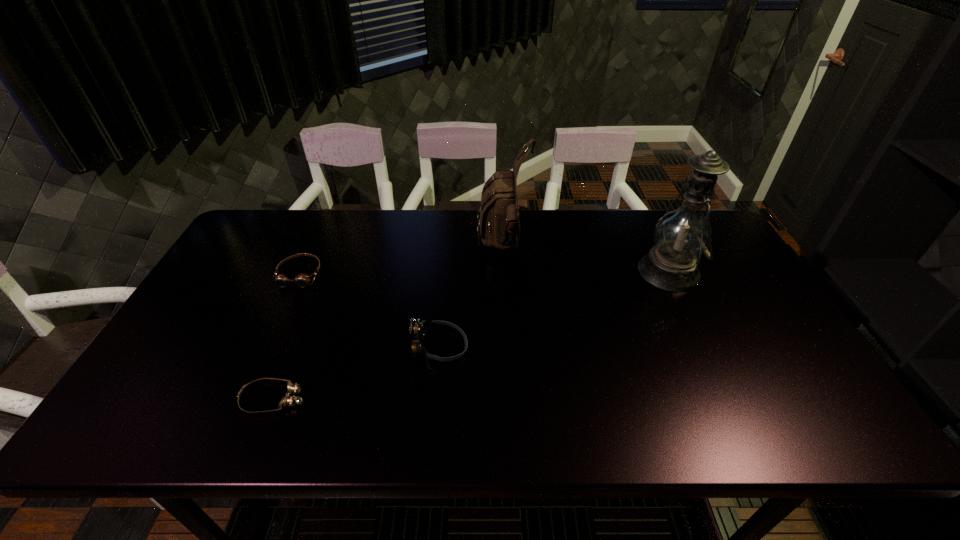
Find the location of a particular element. This screenshot has height=540, width=960. the tallest object is located at coordinates (681, 236).

Where is `the rightmost object`? This screenshot has height=540, width=960. the rightmost object is located at coordinates (681, 236).

Identify the location of the second tallest object. (498, 221).

Where is `the second object from right to left`? The width and height of the screenshot is (960, 540). the second object from right to left is located at coordinates (498, 221).

Where is `the fourth farthest object`? The width and height of the screenshot is (960, 540). the fourth farthest object is located at coordinates (420, 328).

The image size is (960, 540). Find the location of `the second farthest goggles`. the second farthest goggles is located at coordinates (420, 328).

In order to click on the fourth tallest object in this screenshot , I will do `click(302, 280)`.

At what (x,y) coordinates should I click in order to perform the action: click on the farthest goggles. Please return your answer as a coordinate pair (x, y). Looking at the image, I should click on (302, 280).

Find the location of a particular element. the nearest goggles is located at coordinates (288, 400).

The width and height of the screenshot is (960, 540). Find the location of `the nearest object`. the nearest object is located at coordinates (288, 400).